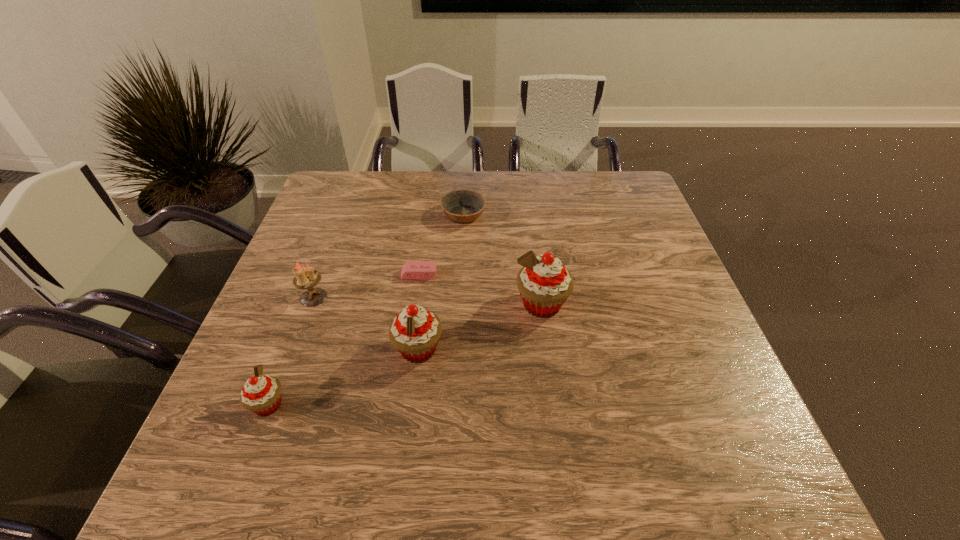
Identify the location of blank space that satisfies the following two spatial constraints: 1. on the front side of the candle holder; 2. on the right side of the rightmost object. (311, 305).